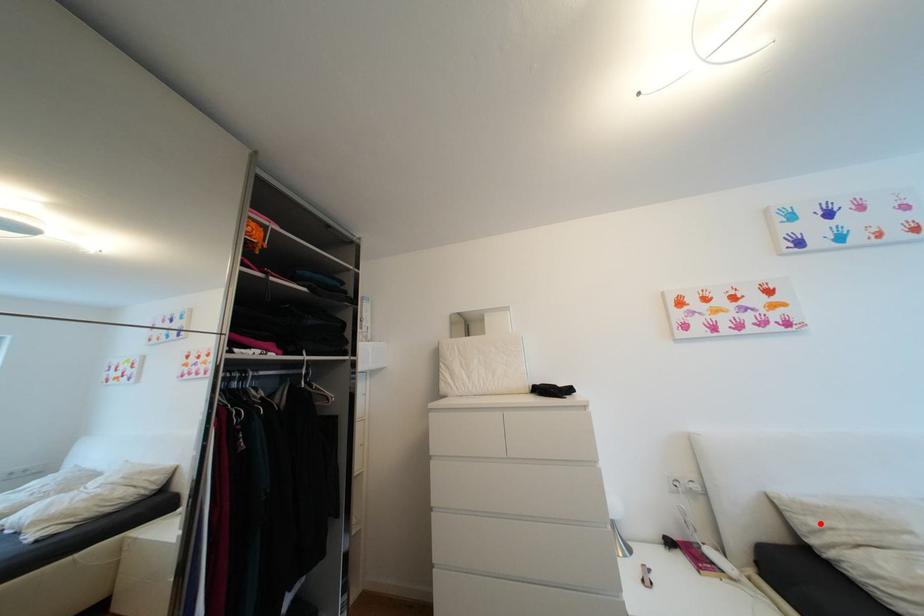
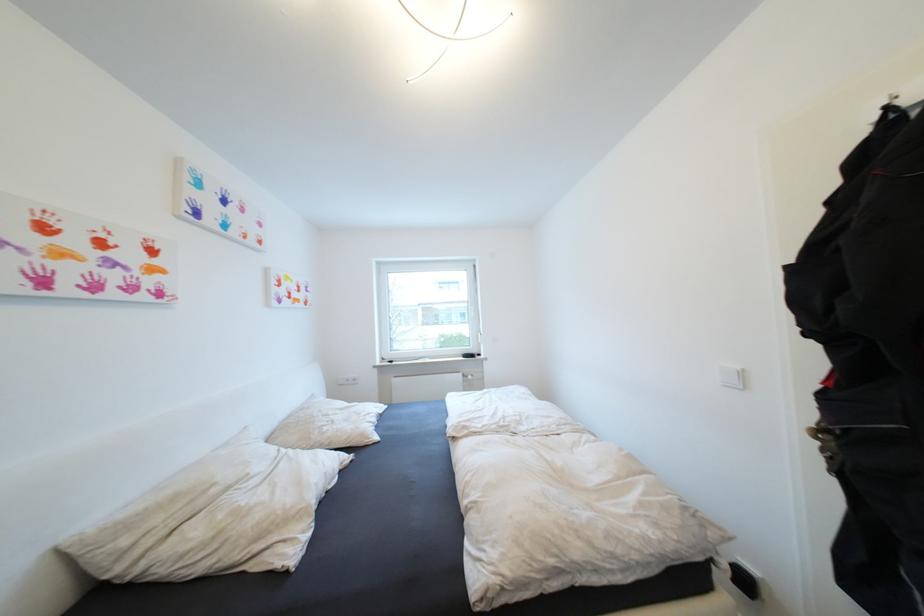
In the second image, find the point that corresponds to the highlighted location in the first image.

(131, 543)